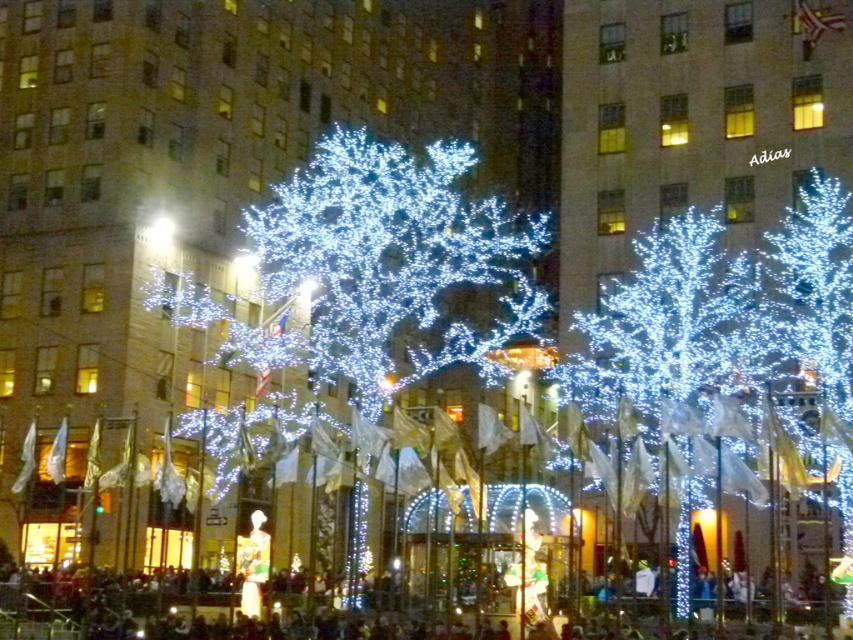
You are standing in the festive nighttime scene looking at the illuminated trees and the building with windows. There are two points marked in the image. Which point is closer to you, point 1 at coordinates (636, 369) or point 2 at coordinates (842, 465)?

Point 1 at coordinates (636, 369) is closer to you because it is further to the viewer than point 2 at coordinates (842, 465).

You are a drone operator tasked with capturing aerial footage of the festive scene. Your drone has a maximum flight range of 20 meters. You need to fly from the illuminated white tree at center to the illuminated plastic tree at center. Can your drone complete this flight without exceeding its range?

The distance between the illuminated white tree at center and the illuminated plastic tree at center is 23.18 meters, which exceeds the drone operator drone maximum flight range of 20 meters. Therefore, the drone cannot complete the flight without exceeding its range.

You are standing in the festive nighttime scene and want to take a photo of both the illuminated white tree at center and the illuminated plastic tree at right. Which tree should you focus on first to ensure both are in the frame?

You should focus on the illuminated white tree at center first because it is closer to you than the illuminated plastic tree at right, so adjusting the camera to include it will also capture the farther tree in the background.